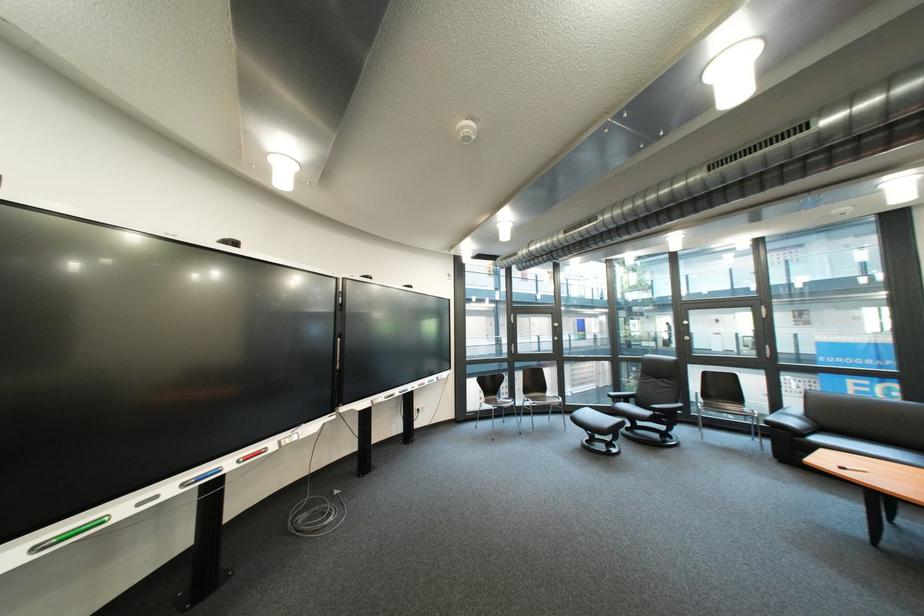
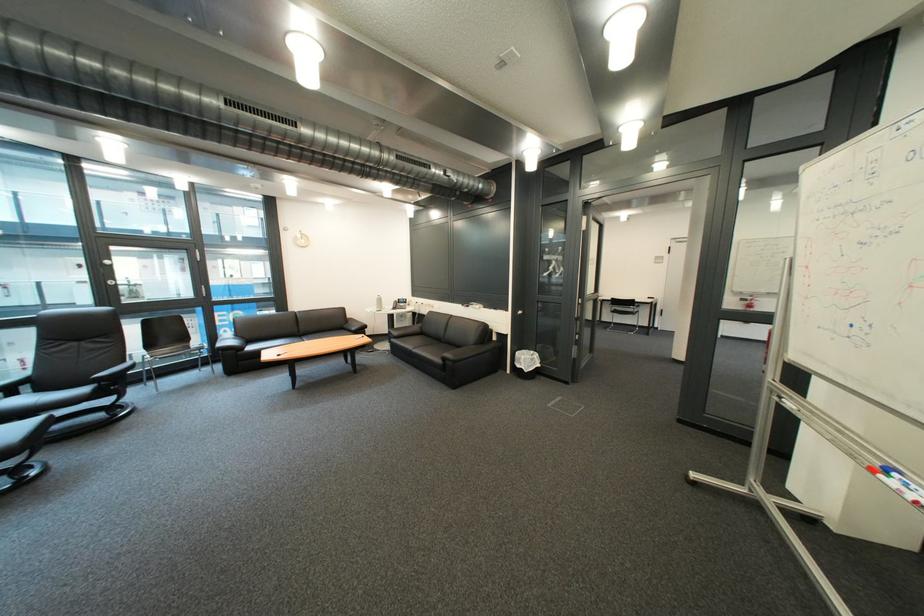
Question: The images are taken continuously from a first-person perspective. In which direction is your viewpoint rotating?

Choices:
 (A) Left
 (B) Right
 (C) Up
 (D) Down

Answer: (B)